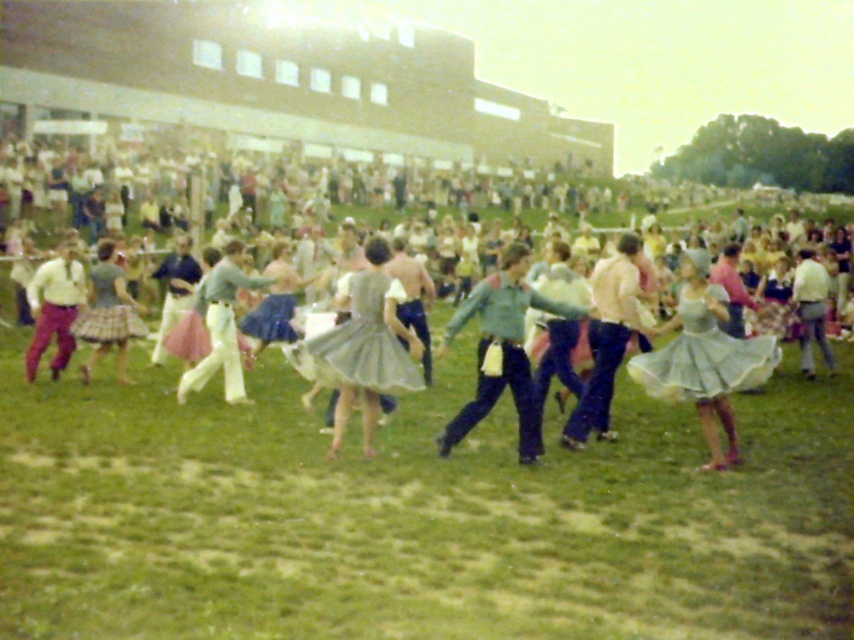
In the scene shown: Can you confirm if green grass at center is taller than plaid fabric skirt at center?

Yes.

Can you confirm if green grass at center is positioned to the right of plaid fabric skirt at center?

Indeed, green grass at center is positioned on the right side of plaid fabric skirt at center.

Locate an element on the screen. The height and width of the screenshot is (640, 854). green grass at center is located at coordinates (416, 516).

Where is `green grass at center`? The image size is (854, 640). green grass at center is located at coordinates (416, 516).

Between green satin dress at center and light green fabric skirt at center, which one appears on the right side from the viewer's perspective?

light green fabric skirt at center is more to the right.

Between point (653, 390) and point (823, 324), which one is positioned in front?

Point (653, 390) is more forward.

What are the coordinates of `green satin dress at center` in the screenshot? It's located at (703, 355).

Describe the element at coordinates (416, 516) in the screenshot. The width and height of the screenshot is (854, 640). I see `green grass at center` at that location.

Between green grass at center and light green skirt at center, which one is positioned lower?

green grass at center

This screenshot has height=640, width=854. I want to click on green grass at center, so click(x=416, y=516).